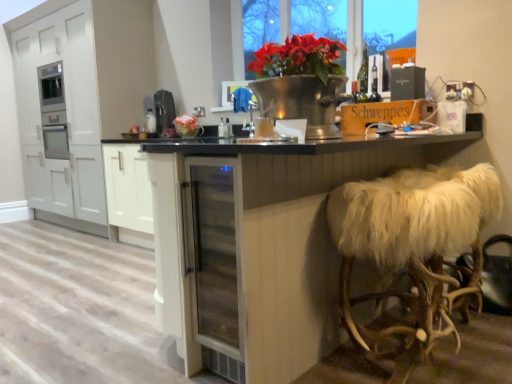
Question: Is red matte flower pot at upper center taller or shorter than transparent glass table at center?

Choices:
 (A) tall
 (B) short

Answer: (B)

Question: Would you say red matte flower pot at upper center is to the left or to the right of transparent glass table at center in the picture?

Choices:
 (A) left
 (B) right

Answer: (B)

Question: Which object is positioned farthest from the white matte cabinet at left?

Choices:
 (A) white fur-covered stool at right
 (B) matte black box at upper right, which is counted as the first appliance, starting from the front
 (C) red matte flower pot at upper center
 (D) transparent glass table at center
 (E) black plastic coffee machine at center, which is the 2th appliance in right-to-left order

Answer: (A)

Question: Which of these objects is positioned closest to the black plastic coffee machine at center, placed as the 1th appliance when sorted from left to right?

Choices:
 (A) white matte cabinet at left
 (B) matte black box at upper right, which is the first appliance from right to left
 (C) transparent glass table at center
 (D) white fur-covered stool at right
 (E) red matte flower pot at upper center

Answer: (A)